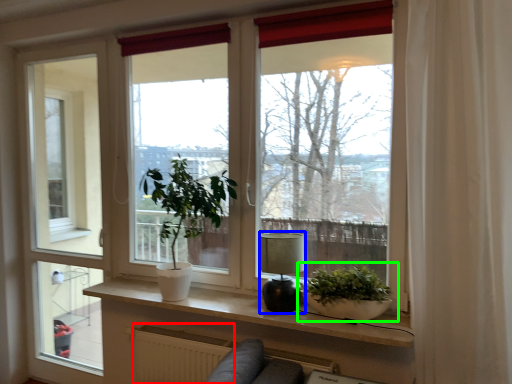
Question: Which object is the closest to the radiator (highlighted by a red box)? Choose among these: lamp (highlighted by a blue box) or houseplant (highlighted by a green box).

Choices:
 (A) lamp
 (B) houseplant

Answer: (A)